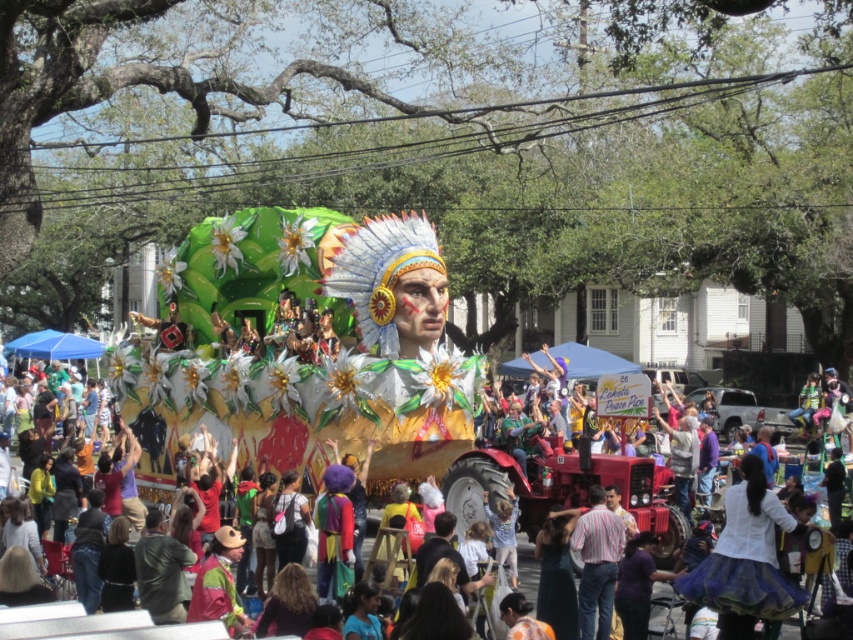
Is golden metallic float at center thinner than blue sequined skirt at lower right?

No, golden metallic float at center is not thinner than blue sequined skirt at lower right.

Which of these two, golden metallic float at center or blue sequined skirt at lower right, stands taller?

With more height is golden metallic float at center.

Identify the location of golden metallic float at center. The height and width of the screenshot is (640, 853). (331, 365).

Find the location of `golden metallic float at center`. golden metallic float at center is located at coordinates (331, 365).

Which is in front, point (782, 579) or point (606, 621)?

Point (782, 579)

Looking at this image, can you confirm if blue sequined skirt at lower right is thinner than striped cotton shirt at center?

No, blue sequined skirt at lower right is not thinner than striped cotton shirt at center.

Who is more forward, (763, 504) or (624, 528)?

Point (763, 504) is in front.

Identify the location of blue sequined skirt at lower right. (746, 563).

Does golden metallic float at center have a lesser height compared to striped cotton shirt at center?

In fact, golden metallic float at center may be taller than striped cotton shirt at center.

Is golden metallic float at center further to camera compared to striped cotton shirt at center?

Yes.

Who is more forward, (329,256) or (614,524)?

Point (614,524) is in front.

Find the location of a particular element. This screenshot has height=640, width=853. golden metallic float at center is located at coordinates (331, 365).